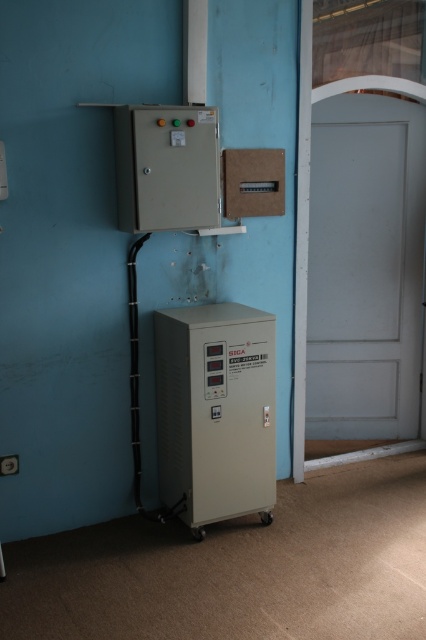
Who is positioned more to the left, gray matte power supply at center or beige plastic control panel at upper center?

Positioned to the left is beige plastic control panel at upper center.

Image resolution: width=426 pixels, height=640 pixels. Describe the element at coordinates (215, 410) in the screenshot. I see `gray matte power supply at center` at that location.

Find the location of a particular element. Image resolution: width=426 pixels, height=640 pixels. gray matte power supply at center is located at coordinates (215, 410).

Between point (409, 211) and point (187, 212), which one is positioned behind?

The point (409, 211) is more distant.

Is point (348, 209) positioned after point (218, 196)?

Yes, it is.

Does point (412, 205) lie behind point (218, 156)?

Yes, point (412, 205) is farther from viewer.

The height and width of the screenshot is (640, 426). Identify the location of white matte door at right. point(365,268).

In the scene shown: Between white matte door at right and gray matte power supply at center, which one appears on the right side from the viewer's perspective?

white matte door at right

Is point (423, 134) closer to camera compared to point (255, 442)?

No, (423, 134) is further to viewer.

At what (x,y) coordinates should I click in order to perform the action: click on white matte door at right. Please return your answer as a coordinate pair (x, y). This screenshot has width=426, height=640. Looking at the image, I should click on (365, 268).